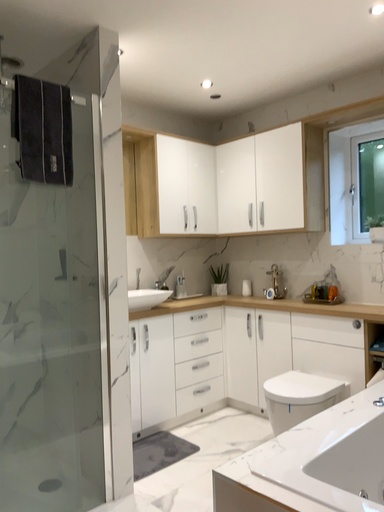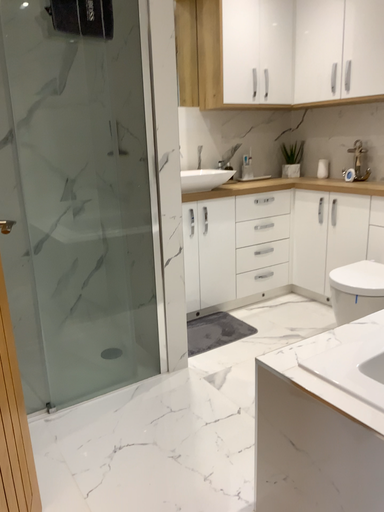
Question: How did the camera likely rotate when shooting the video?

Choices:
 (A) rotated downward
 (B) rotated upward

Answer: (A)